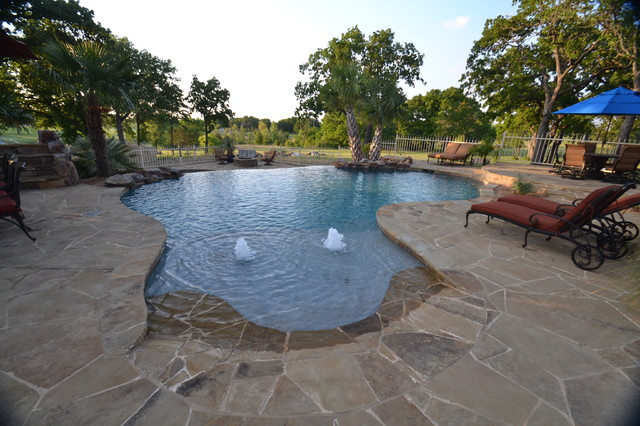
The height and width of the screenshot is (426, 640). Identify the location of upright chairs. (9, 200), (6, 177).